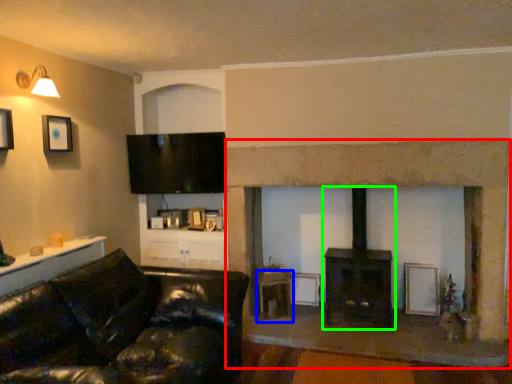
Question: Which object is positioned farthest from fireplace (highlighted by a red box)? Select from table (highlighted by a blue box) and wood burning stove (highlighted by a green box).

Choices:
 (A) table
 (B) wood burning stove

Answer: (A)